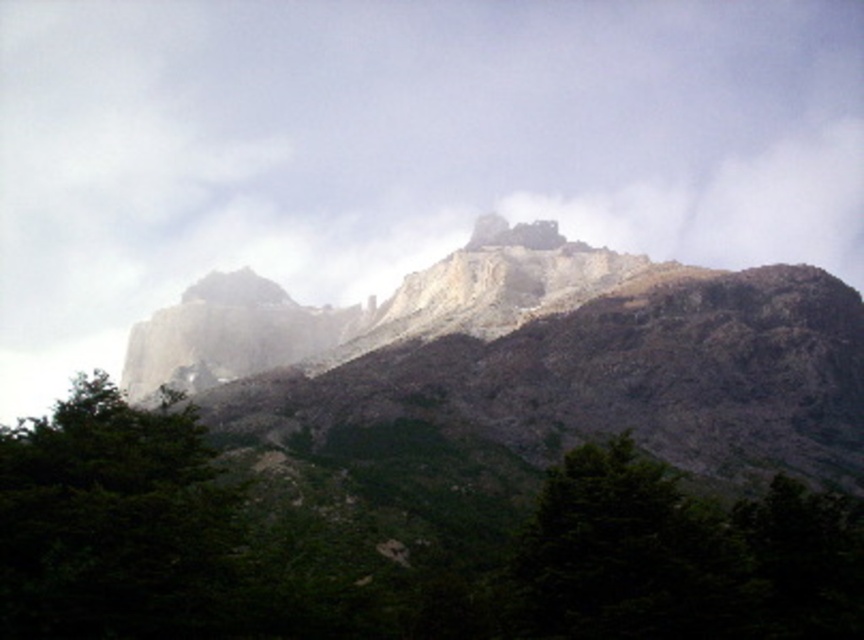
Question: Is rugged stone mountain at center bigger than green leafy tree at lower left?

Choices:
 (A) yes
 (B) no

Answer: (A)

Question: Which object appears farthest from the camera in this image?

Choices:
 (A) green matte tree at lower center
 (B) rugged stone castle at upper center
 (C) rugged stone mountain at center

Answer: (B)

Question: Considering the real-world distances, which object is closest to the green leafy tree at lower left?

Choices:
 (A) green matte tree at lower center
 (B) rugged stone castle at upper center
 (C) white foggy cloud at upper center

Answer: (A)

Question: Which object is the farthest from the rugged stone mountain at center?

Choices:
 (A) white foggy cloud at upper center
 (B) green matte tree at lower center
 (C) rugged stone castle at upper center

Answer: (A)

Question: Can you confirm if green leafy tree at lower left is positioned to the right of rugged stone castle at upper center?

Choices:
 (A) yes
 (B) no

Answer: (B)

Question: Can you confirm if white foggy cloud at upper center is smaller than rugged stone castle at upper center?

Choices:
 (A) yes
 (B) no

Answer: (B)